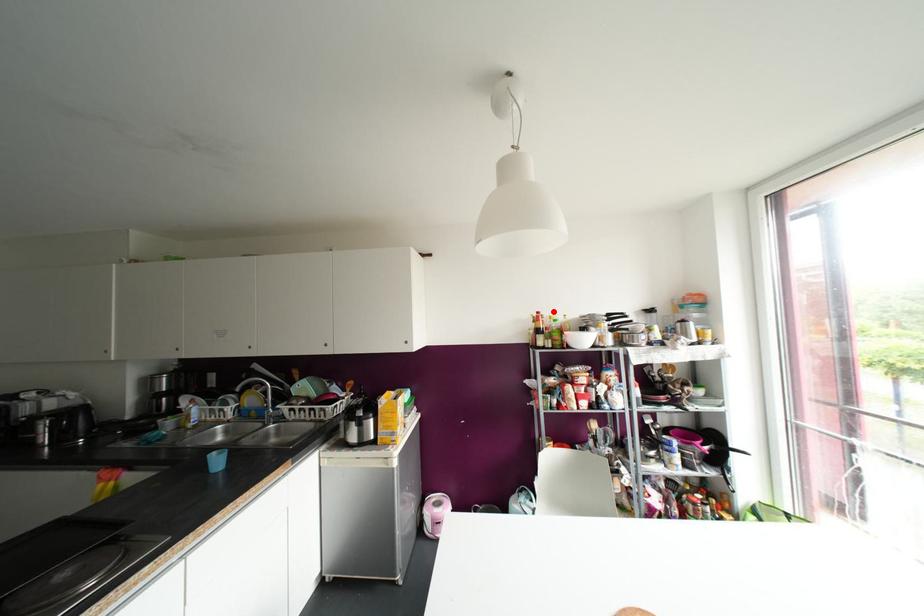
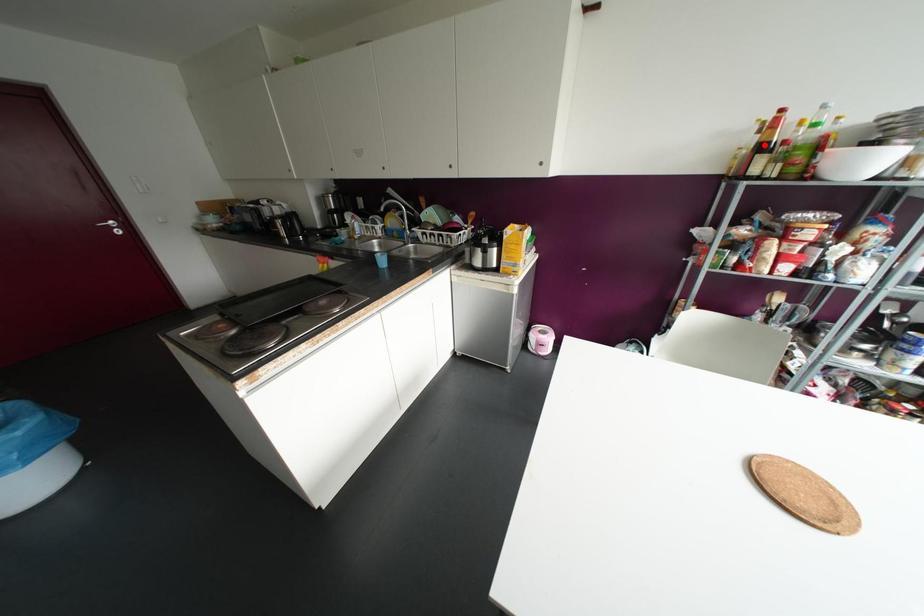
I am providing you with two images of the same scene from different viewpoints. A red point is marked on the first image and another point is marked on the second image. Are the points marked in image1 and image2 representing the same 3D position?

No